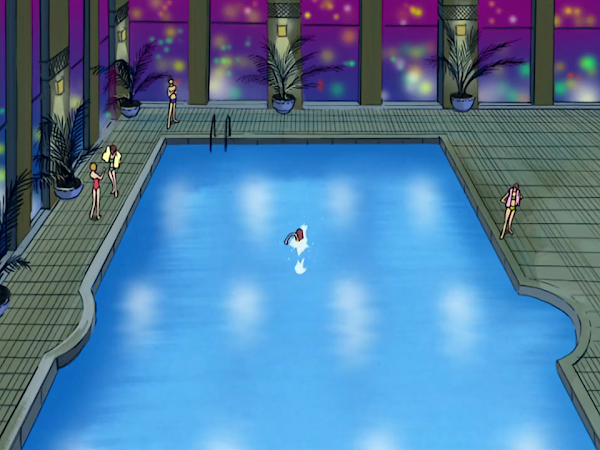
At what (x,y) coordinates should I click in order to perform the action: click on purple back window. Please return your answer as a coordinate pair (x, y). Looking at the image, I should click on (586, 71), (508, 78), (395, 76), (345, 75), (242, 75), (150, 68).